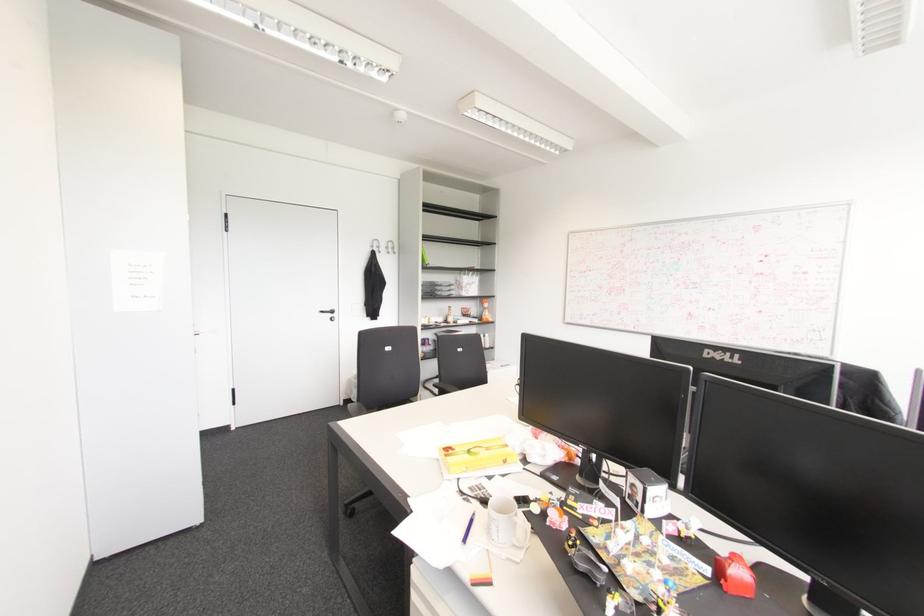
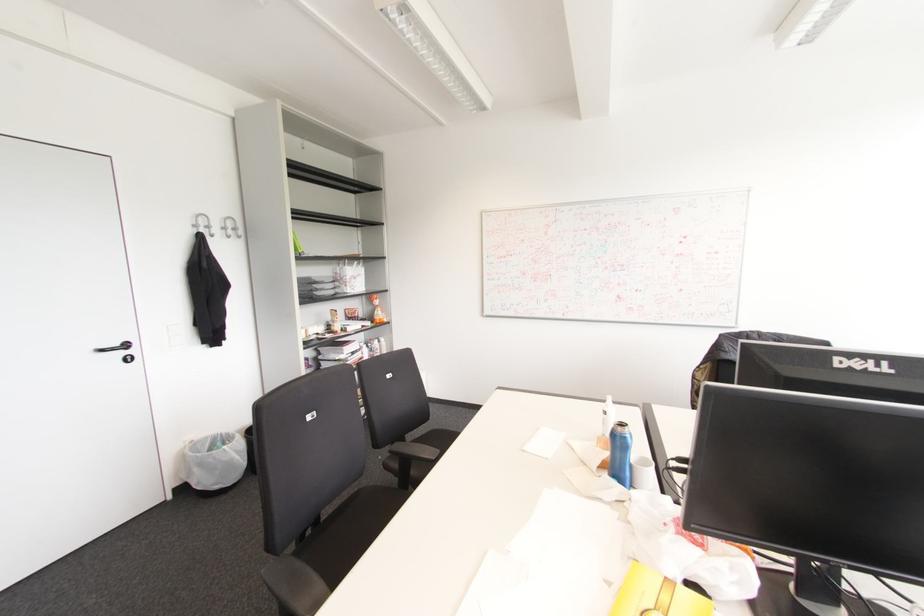
Where in the second image is the point corresponding to point (332, 310) from the first image?

(126, 345)